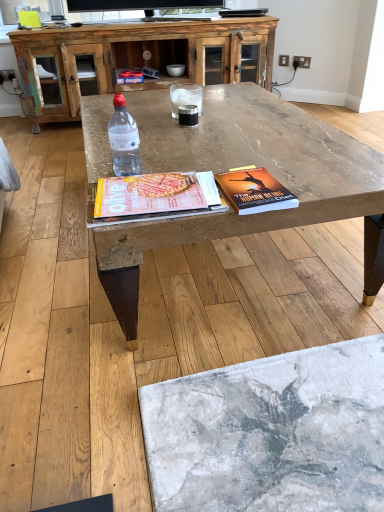
Where is `vacant space in front of black rubberized cup at center`? This screenshot has height=512, width=384. vacant space in front of black rubberized cup at center is located at coordinates (193, 137).